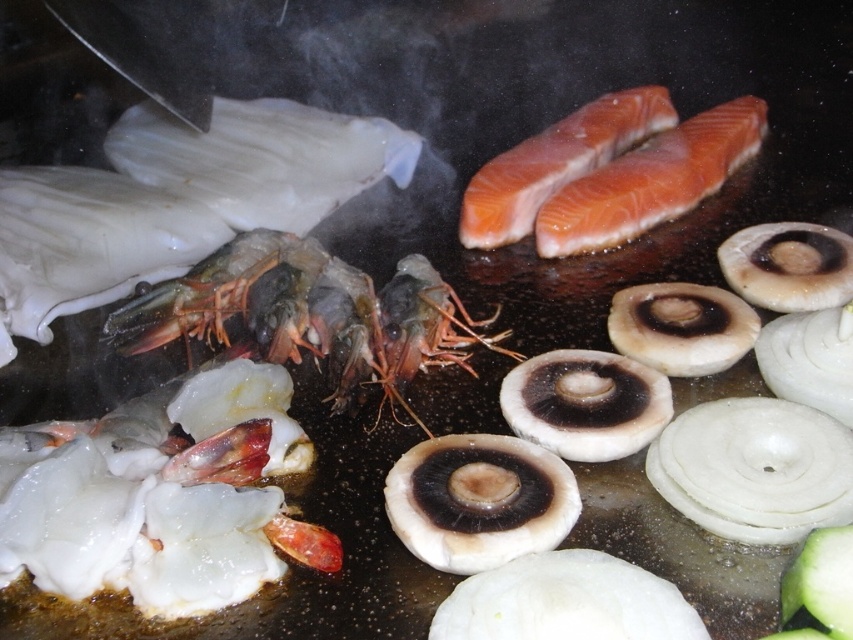
Is translucent white shrimp at lower left smaller than shiny red prawns at center?

Yes, translucent white shrimp at lower left is smaller than shiny red prawns at center.

Is translucent white shrimp at lower left bigger than shiny red prawns at center?

No, translucent white shrimp at lower left is not bigger than shiny red prawns at center.

Locate an element on the screen. The width and height of the screenshot is (853, 640). translucent white shrimp at lower left is located at coordinates (161, 496).